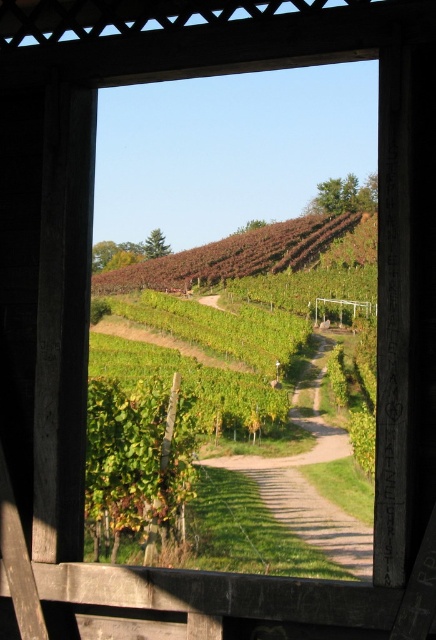
You are standing in front of the wooden structure looking at the vineyard. There are two points marked on the image. Which point, point (245, 467) or point (102, 285), is closer to you?

Point (245, 467) is closer to the camera than point (102, 285).

You are a gardener planning to mow the green grassy path at center and the brown leafy hillside at upper center. Which area requires less time to mow?

The green grassy path at center requires less time to mow since it is smaller than the brown leafy hillside at upper center.

You are planning to walk from the green grassy path at center to the brown leafy hillside at upper center. Given that your average walking pace is 3 feet per second, how long will it take you to reach the hillside?

The distance between the green grassy path at center and the brown leafy hillside at upper center is 165.99 feet. At a walking pace of 3 feet per second, it would take approximately 55.33 seconds to reach the hillside.